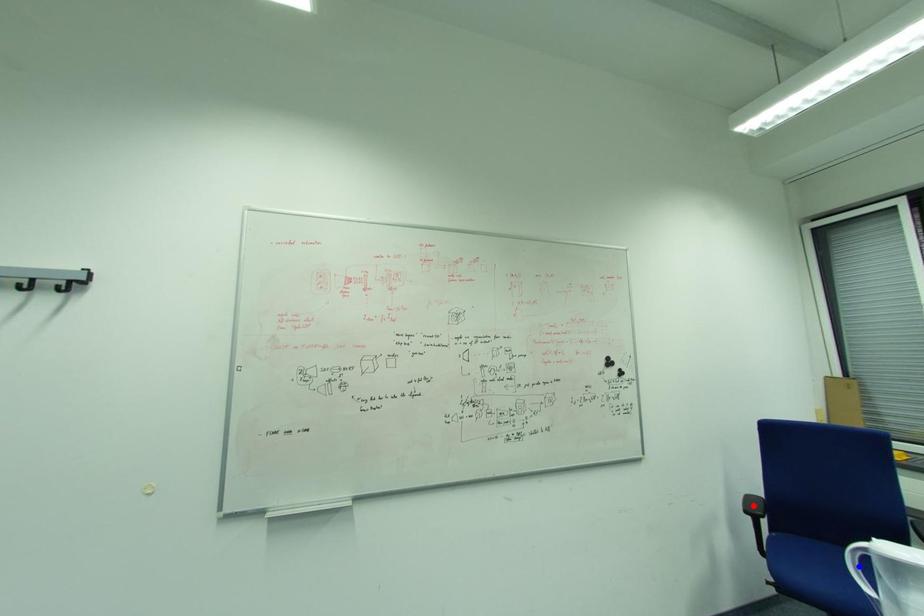
Question: In the image, two points are highlighted. Which point is nearer to the camera? Reply with the corresponding letter.

Choices:
 (A) blue point
 (B) red point

Answer: (A)